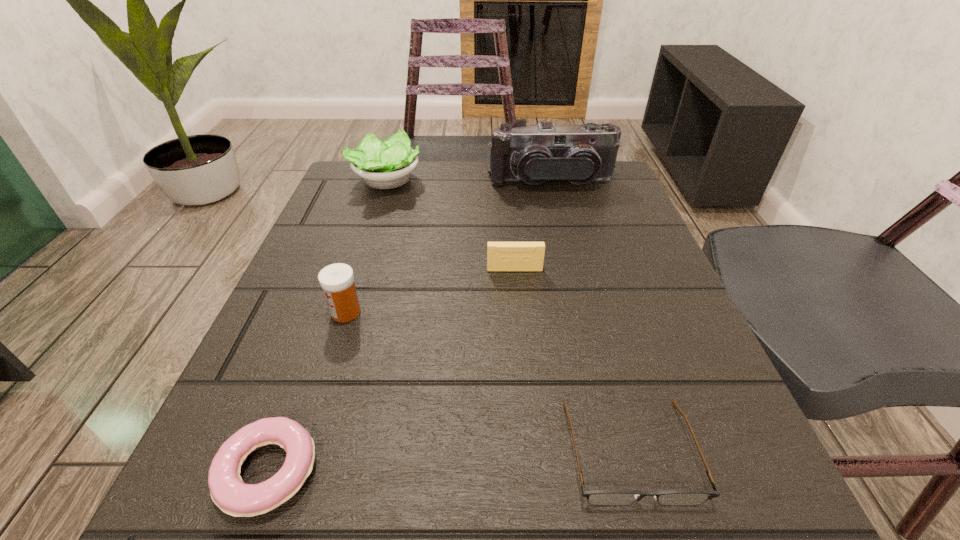
Locate an element on the screen. The width and height of the screenshot is (960, 540). unoccupied area between the third farthest object and the spectacles is located at coordinates (572, 360).

I want to click on object that is the fifth closest to the fourth nearest object, so click(x=234, y=497).

Locate which object is the fifth closest to the spectacles. Please provide its 2D coordinates. Your answer should be formatted as a tuple, i.e. [(x, y)], where the tuple contains the x and y coordinates of a point satisfying the conditions above.

[(387, 164)]

This screenshot has height=540, width=960. In order to click on vacant region that satisfies the following two spatial constraints: 1. on the back side of the doughnut; 2. on the left side of the lettuce in this screenshot , I will do `click(374, 181)`.